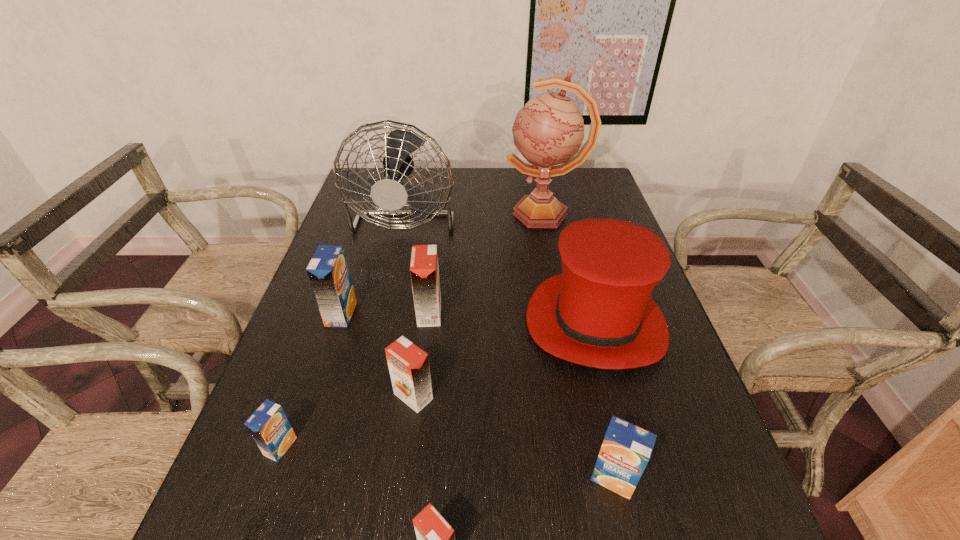
What are the coordinates of `the rightmost orange juice` in the screenshot? It's located at point(626,449).

Locate an element on the screen. the smallest blue orange_juice is located at coordinates (269, 426).

The image size is (960, 540). In order to click on free space located 0.150m on the front-facing side of the globe in this screenshot , I will do `click(458, 214)`.

Find the location of a particular element. Image resolution: width=960 pixels, height=540 pixels. free space located on the front-facing side of the globe is located at coordinates (399, 214).

At what (x,y) coordinates should I click in order to perform the action: click on free region located on the front-facing side of the globe. Please return your answer as a coordinate pair (x, y). Looking at the image, I should click on click(x=391, y=214).

Locate an element on the screen. vacant space located on the front-facing side of the fan is located at coordinates (383, 315).

This screenshot has height=540, width=960. What are the coordinates of `vacant region located on the back of the red hat` in the screenshot? It's located at (573, 241).

This screenshot has height=540, width=960. I want to click on vacant space situated 0.060m on the left of the biggest blue orange_juice, so click(x=304, y=314).

Image resolution: width=960 pixels, height=540 pixels. What are the coordinates of `free space located 0.140m on the back of the biggest orange orange juice` in the screenshot? It's located at tap(435, 266).

Where is `free location located on the right of the second farthest orange orange juice`? The image size is (960, 540). free location located on the right of the second farthest orange orange juice is located at coordinates (516, 396).